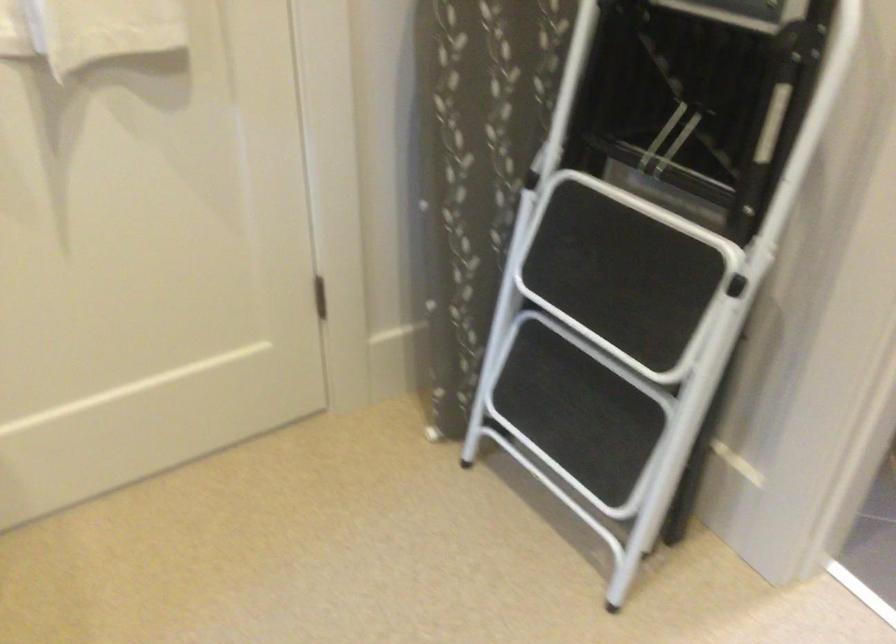
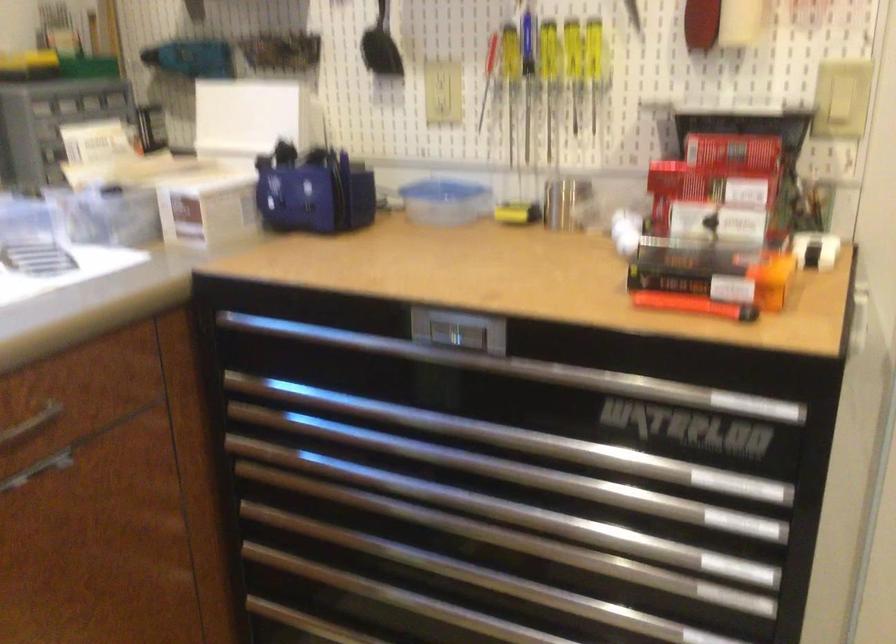
Question: Based on the continuous images, in which direction is the camera rotating? Reply with the corresponding letter.

Choices:
 (A) Left
 (B) Right
 (C) Up
 (D) Down

Answer: (A)